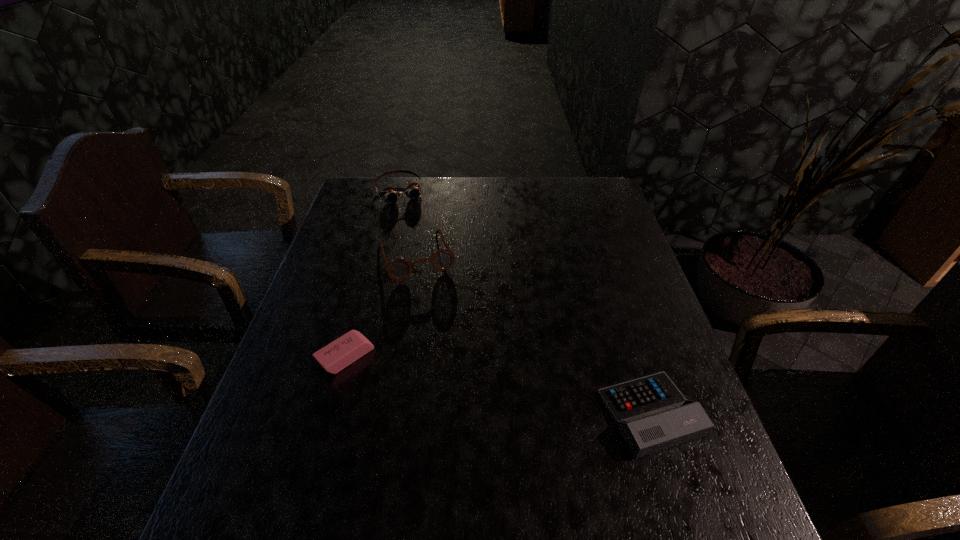
You are a GUI agent. You are given a task and a screenshot of the screen. Output one action in this format:
    pyautogui.click(x=<x>, y=<y>)
    Task: Click on the object situated at the far left corner
    
    Given the screenshot: What is the action you would take?
    pyautogui.click(x=391, y=195)

The height and width of the screenshot is (540, 960). I want to click on object located at the near right corner, so click(651, 413).

In the image, there is a desktop. Where is `vacant space at the far edge`? vacant space at the far edge is located at coordinates (527, 204).

Identify the location of free space at the near edge of the desktop. Image resolution: width=960 pixels, height=540 pixels. (575, 464).

Image resolution: width=960 pixels, height=540 pixels. Identify the location of vacant space at the left edge of the desktop. (364, 235).

Image resolution: width=960 pixels, height=540 pixels. I want to click on free region at the right edge of the desktop, so click(670, 361).

You are a GUI agent. You are given a task and a screenshot of the screen. Output one action in this format:
    pyautogui.click(x=<x>, y=<y>)
    Task: Click on the vacant space at the far left corner of the desktop
    The width and height of the screenshot is (960, 540).
    Given the screenshot: What is the action you would take?
    pyautogui.click(x=399, y=179)

Where is `vacant point at the near right corner`? Image resolution: width=960 pixels, height=540 pixels. vacant point at the near right corner is located at coordinates (680, 486).

Image resolution: width=960 pixels, height=540 pixels. Find the location of `vacant region between the calculator and the eraser`. vacant region between the calculator and the eraser is located at coordinates click(498, 385).

Find the location of a particular element. free spot between the spectacles and the farthest object is located at coordinates (407, 224).